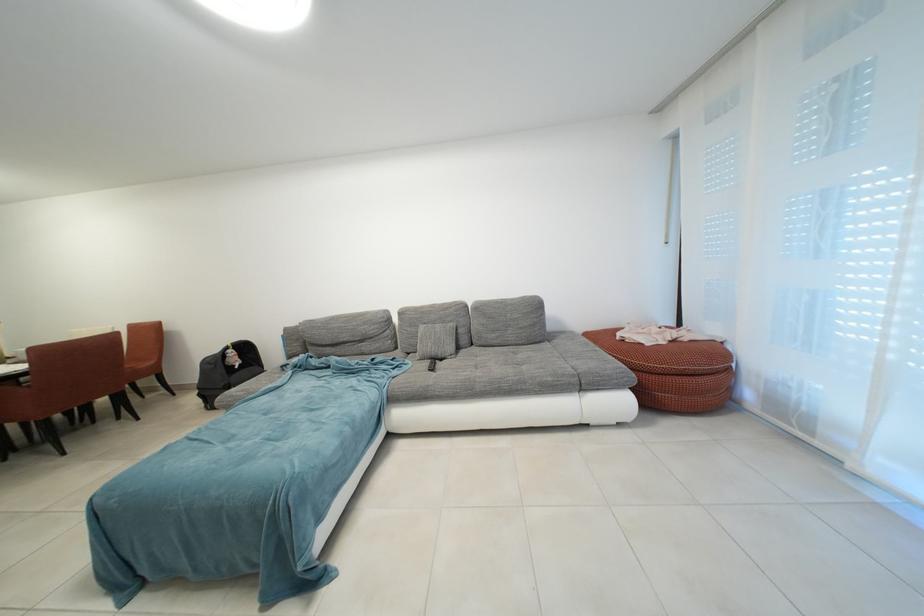
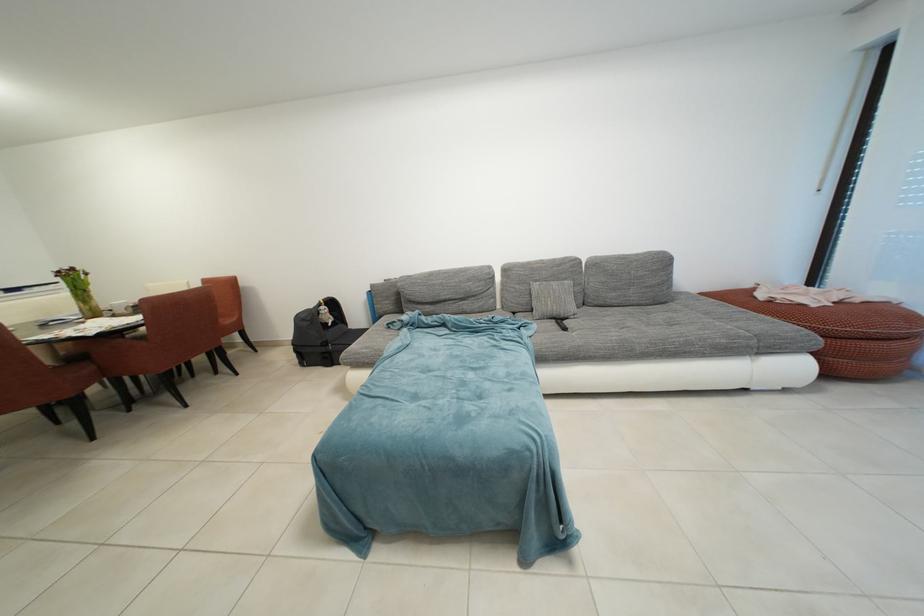
The point at [472,331] is marked in the first image. Where is the corresponding point in the second image?

(588, 289)